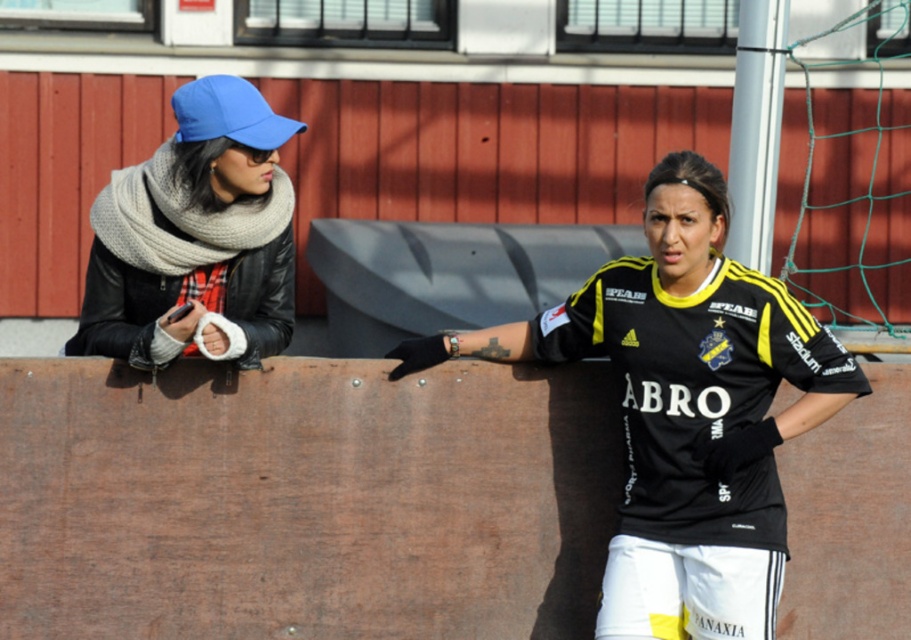
Question: Which object is farther from the camera taking this photo?

Choices:
 (A) black/yellow jersey at center
 (B) knitted gray scarf at left

Answer: (B)

Question: Is black/yellow jersey at center thinner than knitted gray scarf at left?

Choices:
 (A) yes
 (B) no

Answer: (B)

Question: Does black/yellow jersey at center come behind knitted gray scarf at left?

Choices:
 (A) no
 (B) yes

Answer: (A)

Question: Which of the following is the farthest from the observer?

Choices:
 (A) (699, 401)
 (B) (147, 342)

Answer: (B)

Question: Is black/yellow jersey at center below knitted gray scarf at left?

Choices:
 (A) no
 (B) yes

Answer: (B)